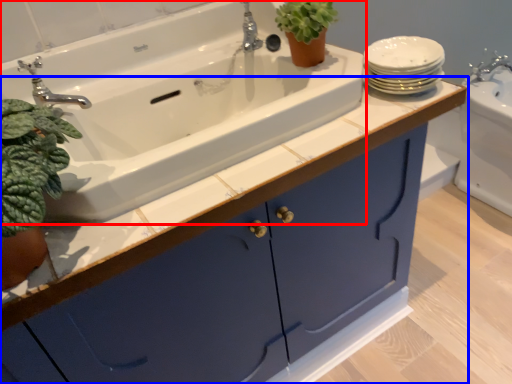
Question: Which object appears closest to the camera in this image, sink (highlighted by a red box) or bathroom cabinet (highlighted by a blue box)?

Choices:
 (A) sink
 (B) bathroom cabinet

Answer: (B)